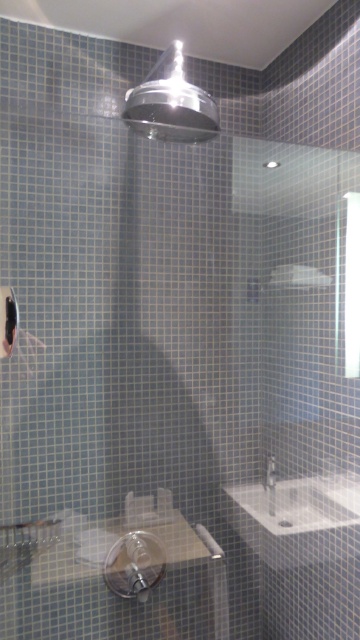
Question: Can you confirm if white glossy sink at lower right is bigger than polished chrome shower head at upper center?

Choices:
 (A) yes
 (B) no

Answer: (B)

Question: Which object is farther from the camera taking this photo?

Choices:
 (A) white glossy faucet at lower right
 (B) white glossy sink at lower right
 (C) polished chrome shower head at upper center

Answer: (A)

Question: Considering the real-world distances, which object is closest to the white glossy sink at lower right?

Choices:
 (A) white glossy faucet at lower right
 (B) polished chrome shower head at upper center

Answer: (A)

Question: Does white glossy sink at lower right have a greater width compared to white glossy faucet at lower right?

Choices:
 (A) no
 (B) yes

Answer: (B)

Question: Which object appears farthest from the camera in this image?

Choices:
 (A) white glossy faucet at lower right
 (B) white glossy sink at lower right
 (C) polished chrome shower head at upper center

Answer: (A)

Question: Does white glossy sink at lower right have a greater width compared to white glossy faucet at lower right?

Choices:
 (A) yes
 (B) no

Answer: (A)